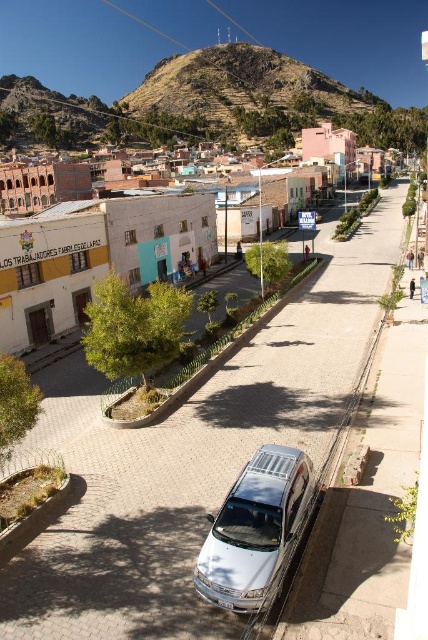
Question: Is white concrete building at center closer to the viewer compared to silver metallic van at center?

Choices:
 (A) yes
 (B) no

Answer: (B)

Question: Which of the following is the closest to the observer?

Choices:
 (A) (223, 593)
 (B) (326, 104)

Answer: (A)

Question: Which object appears closest to the camera in this image?

Choices:
 (A) white concrete building at center
 (B) rugged brown hill at upper center

Answer: (A)

Question: Does white concrete building at center appear on the right side of silver metallic van at center?

Choices:
 (A) yes
 (B) no

Answer: (A)

Question: Which of the following is the farthest from the observer?

Choices:
 (A) silver metallic van at center
 (B) white concrete building at center

Answer: (B)

Question: Can you confirm if white concrete building at center is thinner than rugged brown hill at upper center?

Choices:
 (A) yes
 (B) no

Answer: (A)